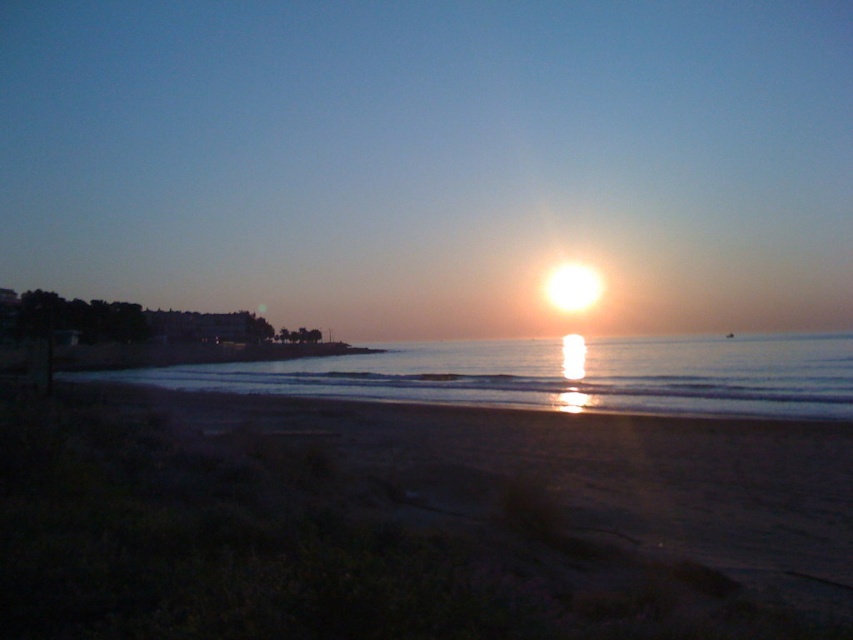
You are planning to build a small sandcastle on the sandy beach at lower left and a dock on the smooth water at center. Considering their sizes, which location would allow for a larger structure?

The smooth water at center has a larger size than the sandy beach at lower left, so building a larger structure there would be possible.

You are standing on the beach facing the water. You see two points marked on the sand. One is at coordinate point(486, 424) and the other at point(692, 342). Which point is closer to you?

Point(486, 424) is in front of point(692, 342), so the point at point(486, 424) is closer to you.